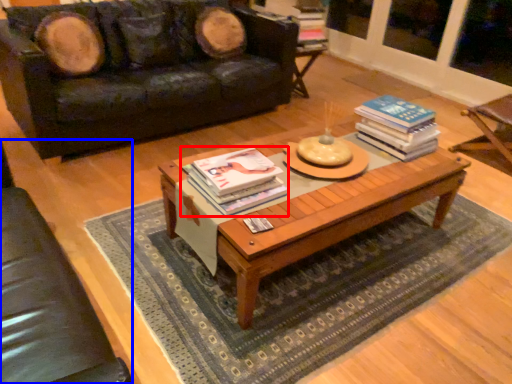
Question: Which object appears closest to the camera in this image, book (highlighted by a red box) or armchair (highlighted by a blue box)?

Choices:
 (A) book
 (B) armchair

Answer: (B)